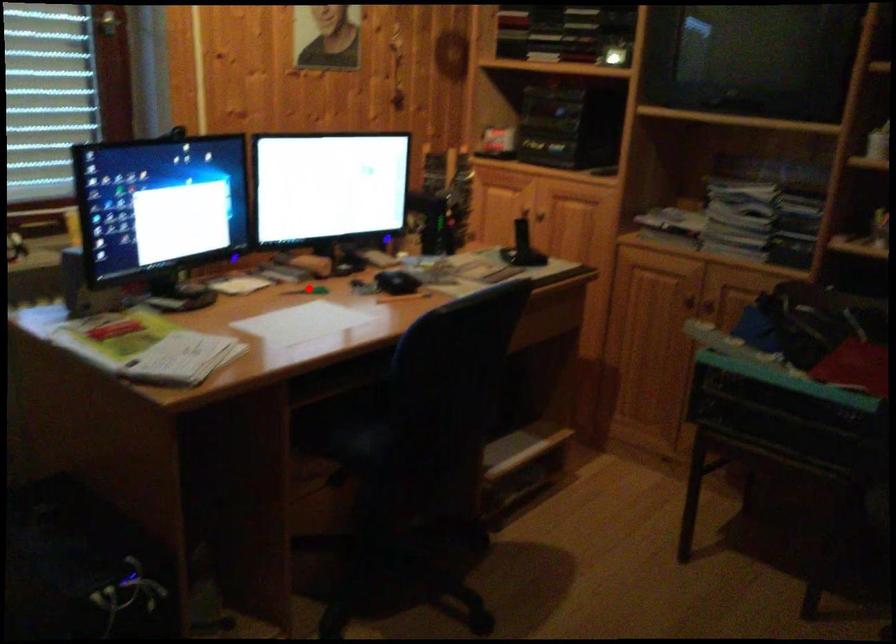
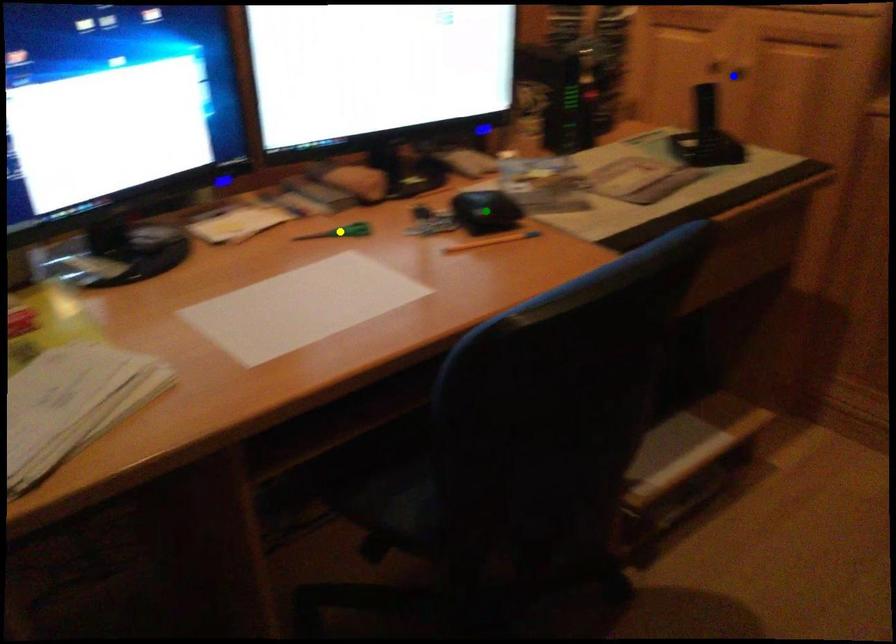
Question: I am providing you with two images of the same scene from different viewpoints. A red point is marked on the first image. You are given multiple points on the second image. Which point in image 2 represents the same 3d spot as the red point in image 1?

Choices:
 (A) yellow point
 (B) green point
 (C) blue point

Answer: (A)